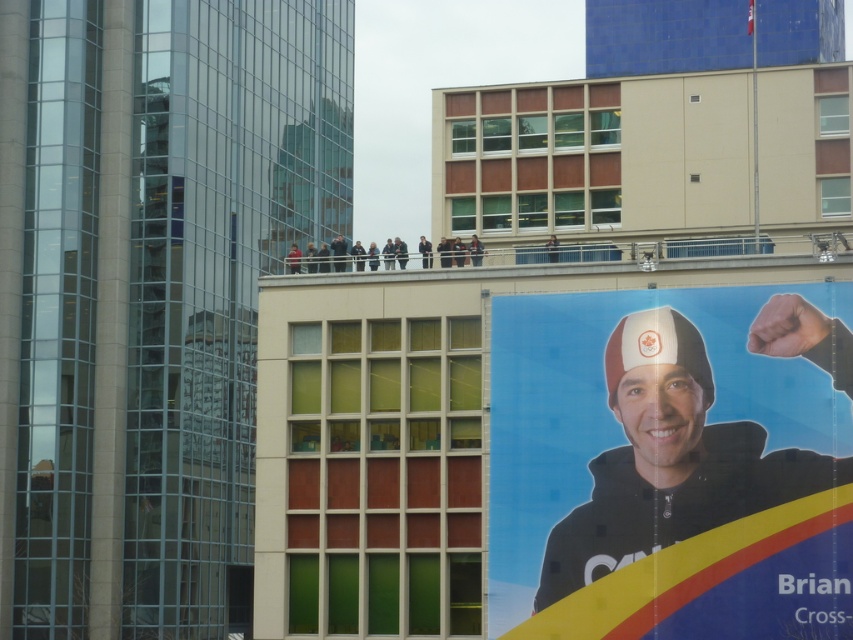
What do you see at coordinates (671, 464) in the screenshot? This screenshot has width=853, height=640. I see `matte black poster at right` at bounding box center [671, 464].

Can you confirm if matte black poster at right is positioned below matte black jacket at upper center?

Yes, matte black poster at right is below matte black jacket at upper center.

The height and width of the screenshot is (640, 853). What do you see at coordinates (671, 464) in the screenshot? I see `matte black poster at right` at bounding box center [671, 464].

Locate an element on the screen. This screenshot has height=640, width=853. matte black poster at right is located at coordinates coord(671,464).